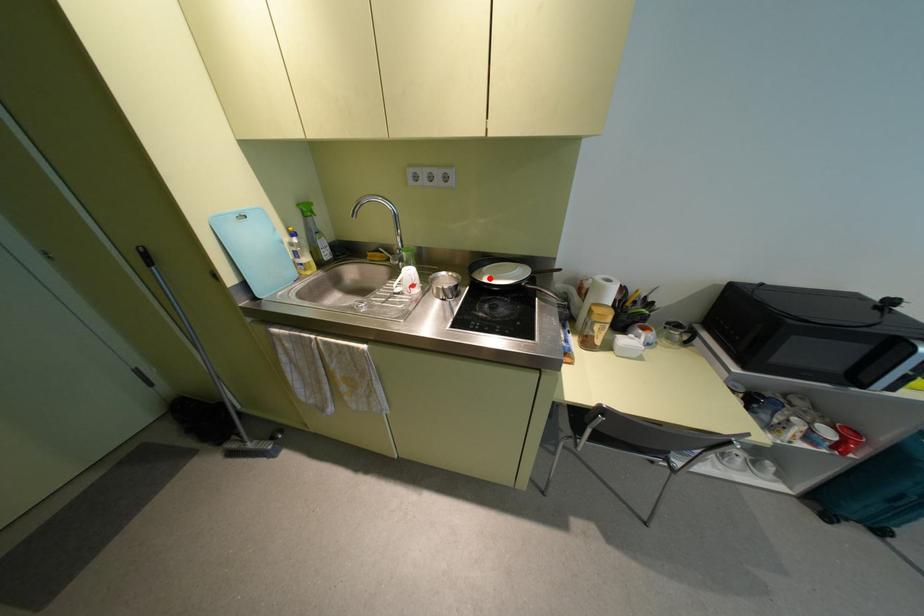
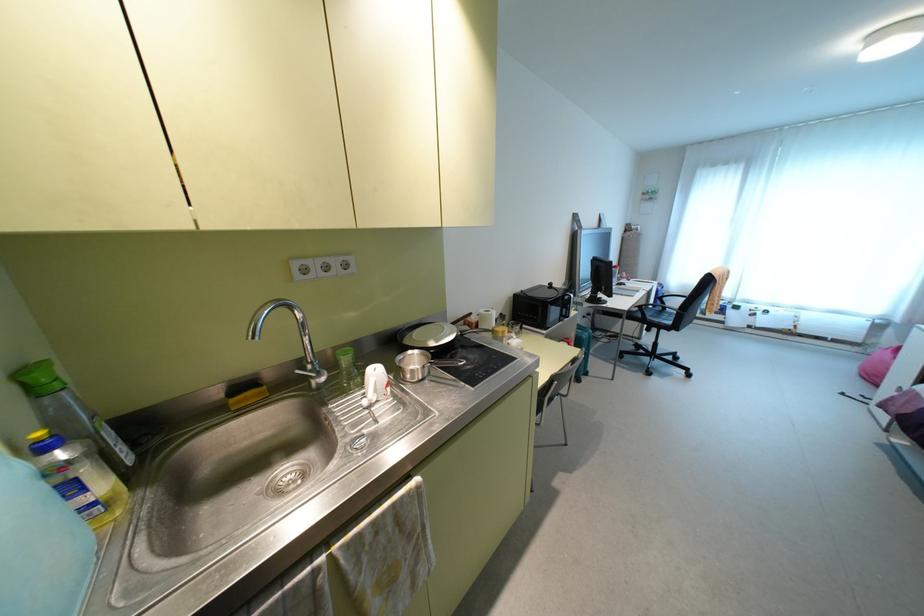
Find the pixel in the second image that matches the highlighted location in the first image.

(435, 341)